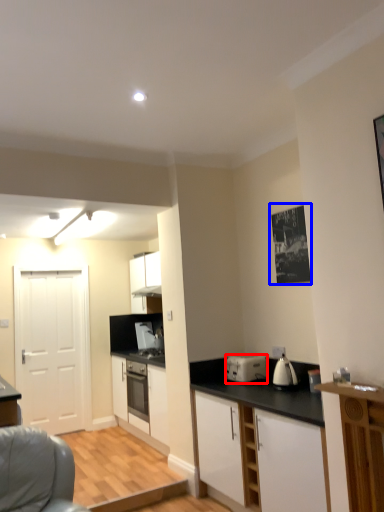
Question: Which of the following is the farthest to the observer, kitchen appliance (highlighted by a red box) or picture frame (highlighted by a blue box)?

Choices:
 (A) kitchen appliance
 (B) picture frame

Answer: (A)